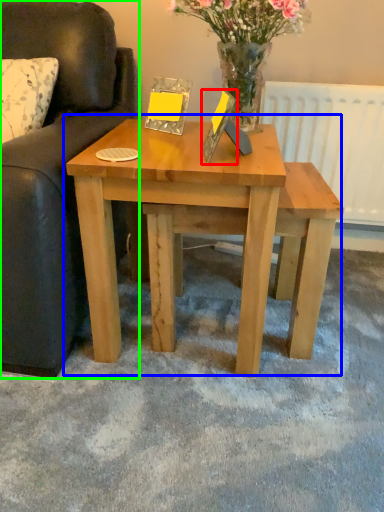
Question: Which object is positioned farthest from picture frame (highlighted by a red box)? Select from coffee table (highlighted by a blue box) and studio couch (highlighted by a green box).

Choices:
 (A) coffee table
 (B) studio couch

Answer: (B)